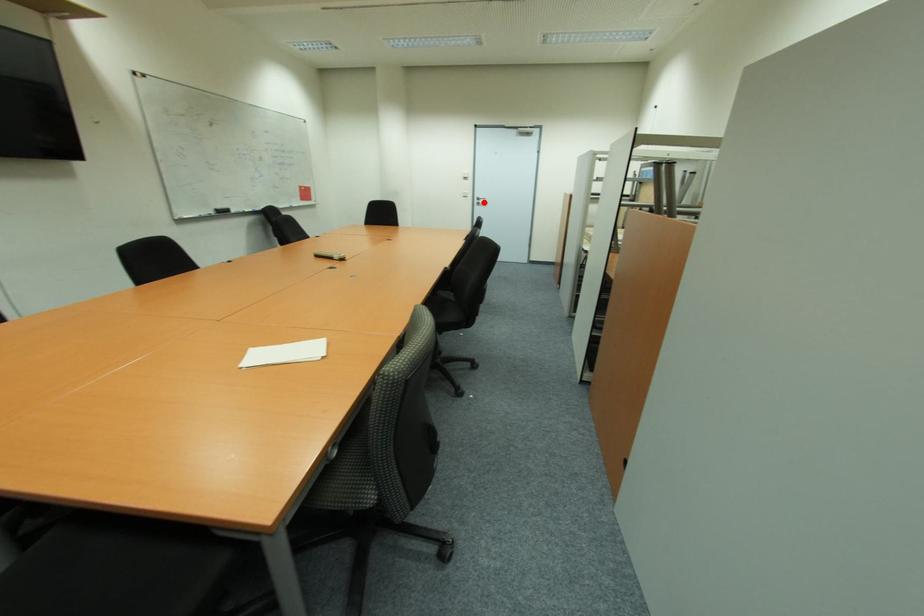
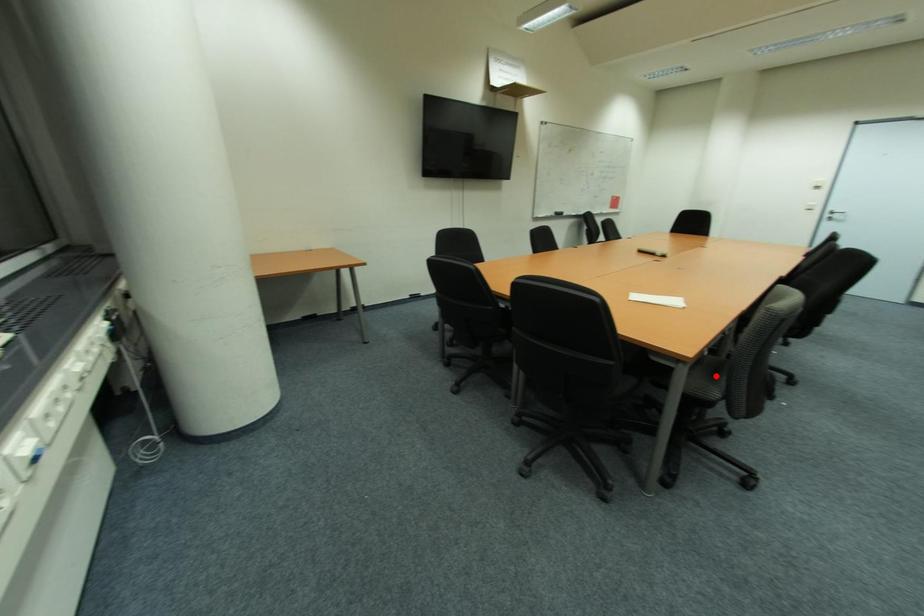
I am providing you with two images of the same scene from different viewpoints. A red point is marked on the first image and another point is marked on the second image. Is the red point in image1 aligned with the point shown in image2?

No